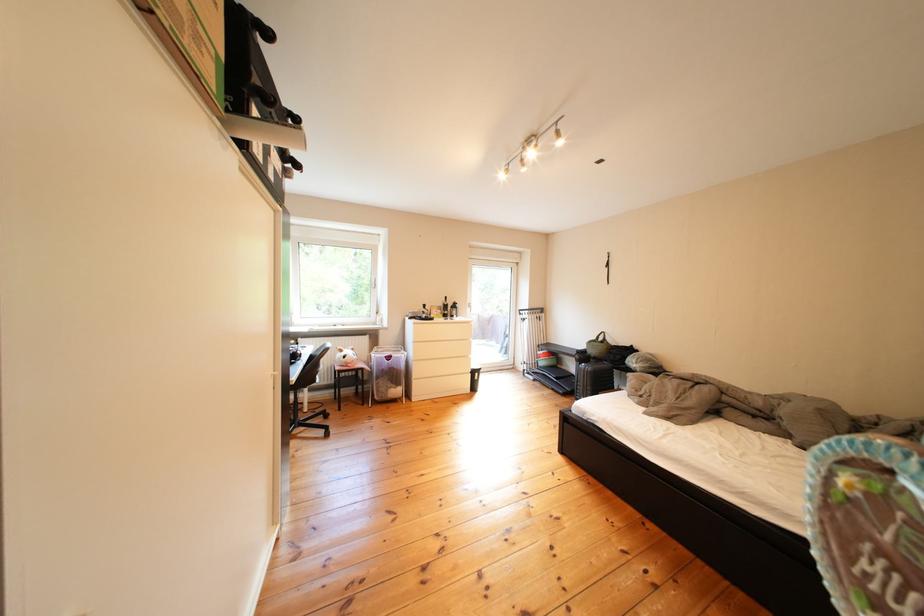
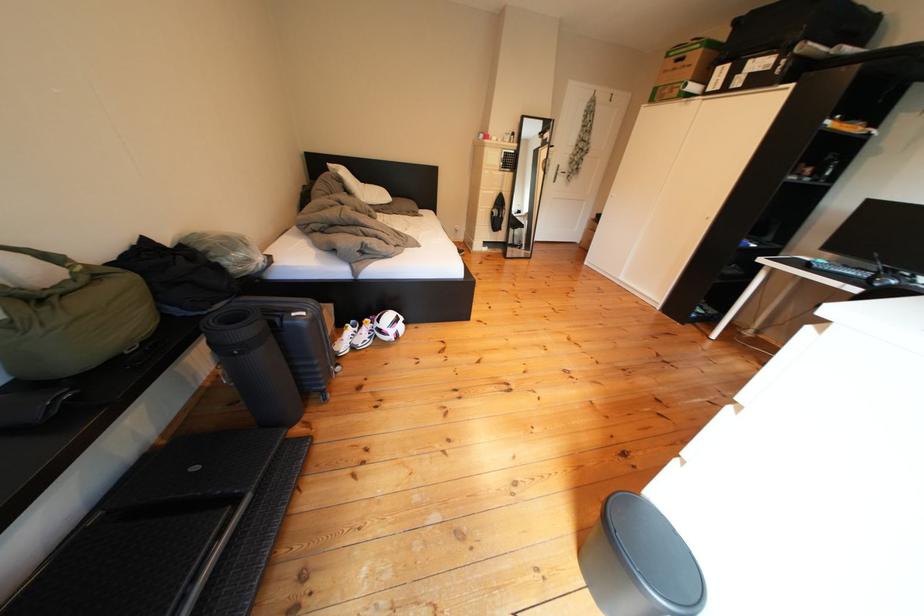
Question: I am providing you with two images of the same scene from different viewpoints. After the viewpoint changes to image2, which objects are now occluded?

Choices:
 (A) black rolled mat
 (B) textured stand grip
 (C) black luggage bag
 (D) small black trashcan

Answer: (D)